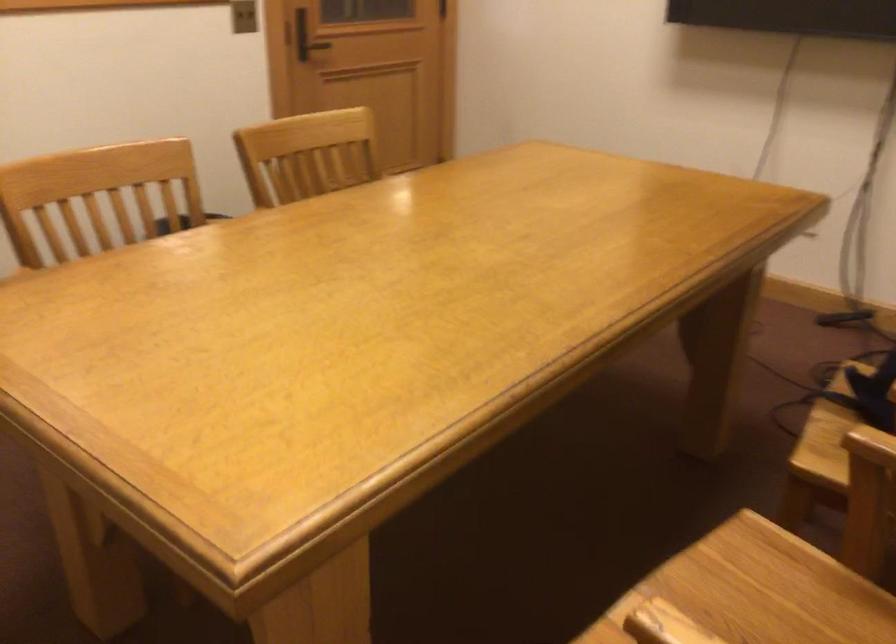
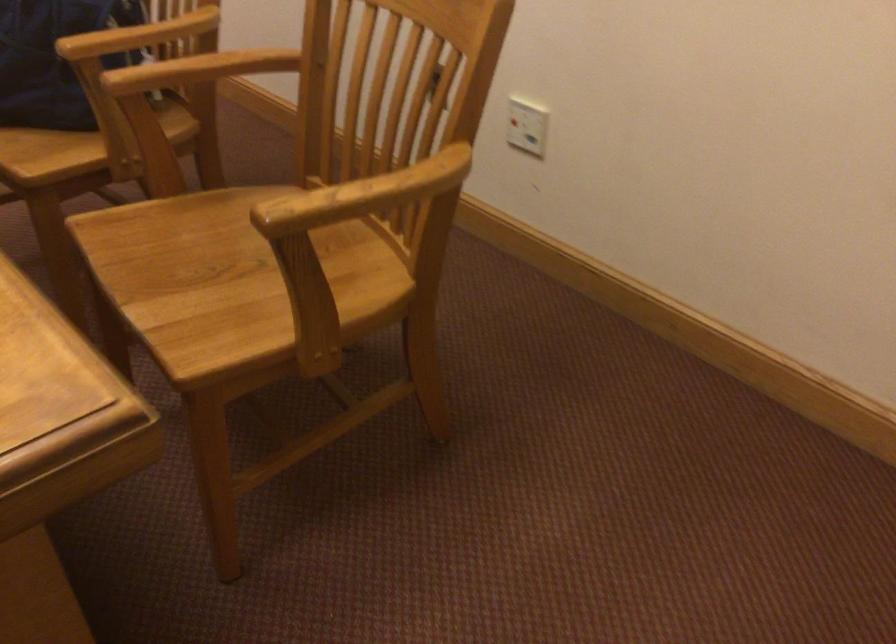
How did the camera likely rotate?

The camera rotated toward right-down.